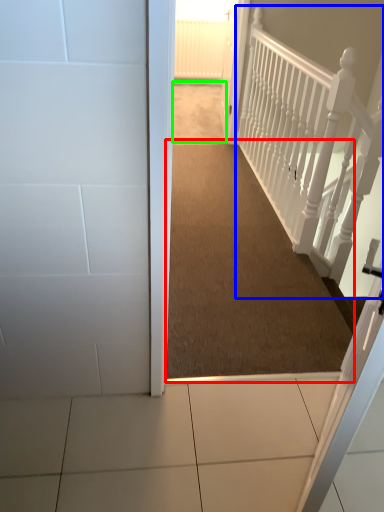
Question: Which is nearer to the corridor (highlighted by a red box)? rail (highlighted by a blue box) or path (highlighted by a green box).

Choices:
 (A) rail
 (B) path

Answer: (A)